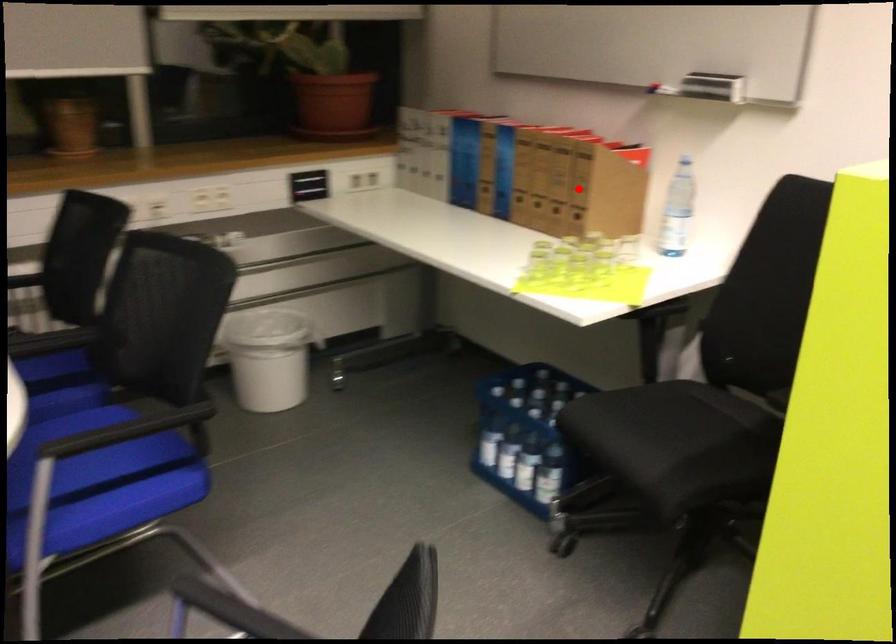
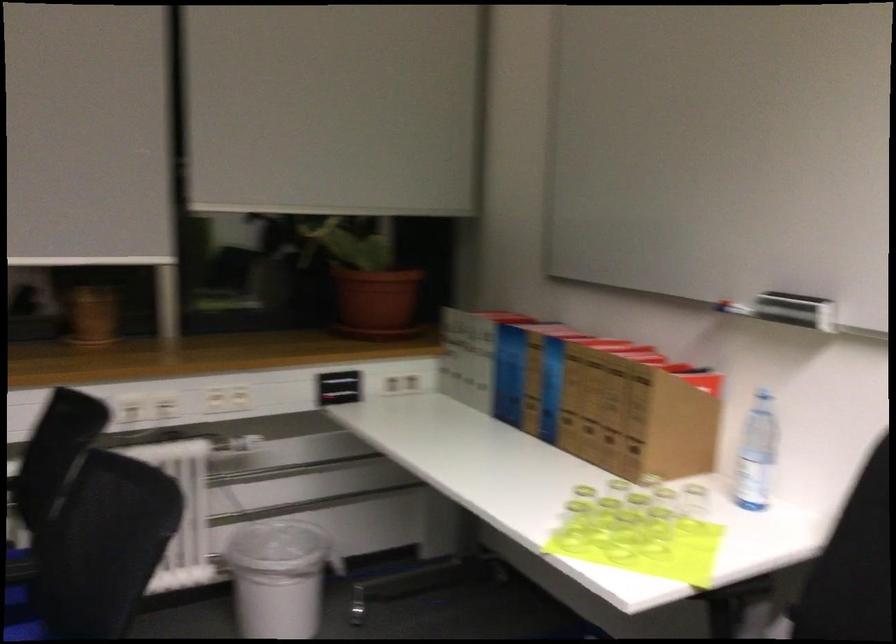
Where in the second image is the point corresponding to the highlighted location from the first image?

(634, 417)